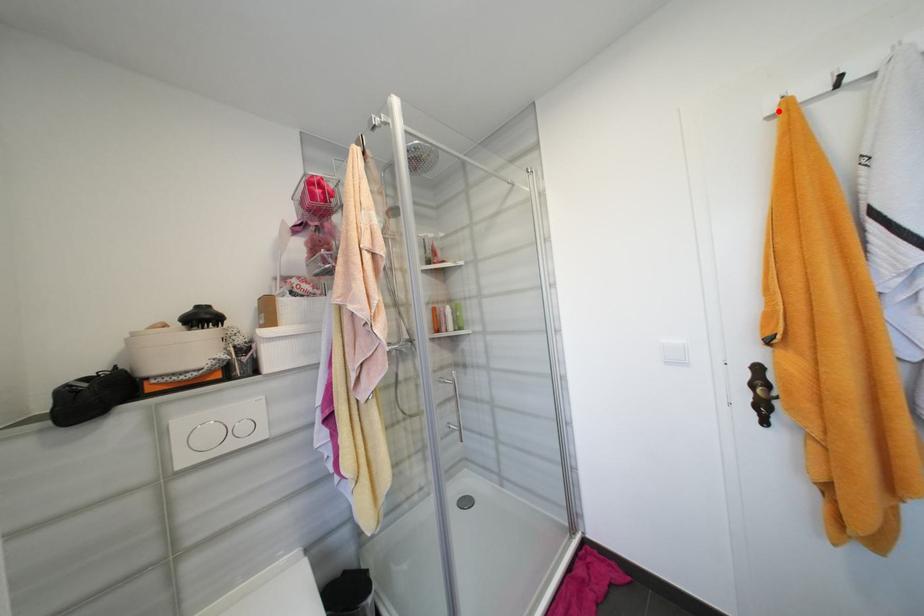
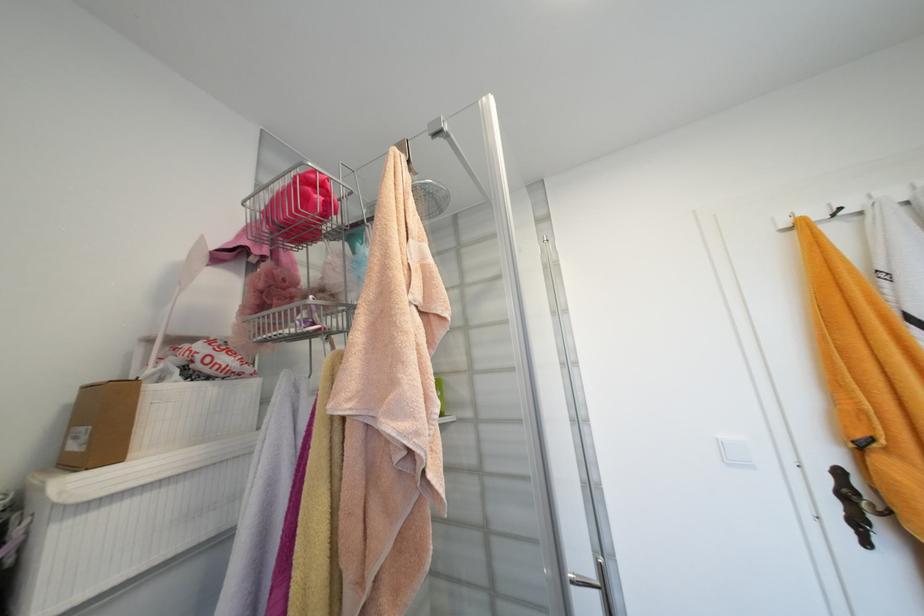
Locate, in the second image, the point that corresponds to the highlighted location in the first image.

(792, 225)